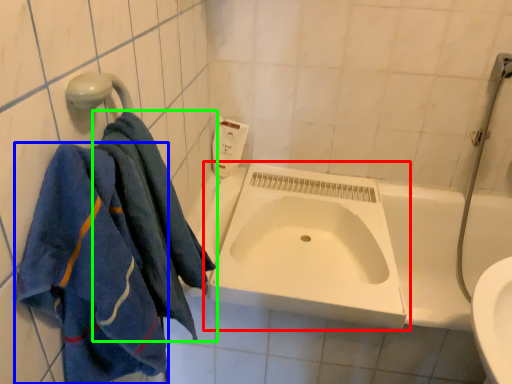
Question: Which object is the farthest from sink (highlighted by a red box)? Choose among these: towel (highlighted by a blue box) or towel (highlighted by a green box).

Choices:
 (A) towel
 (B) towel

Answer: (A)